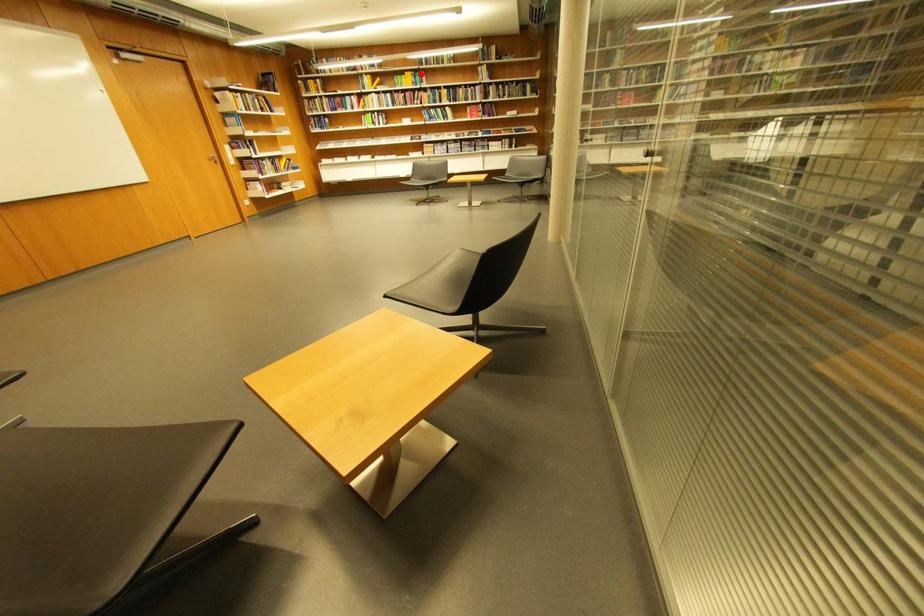
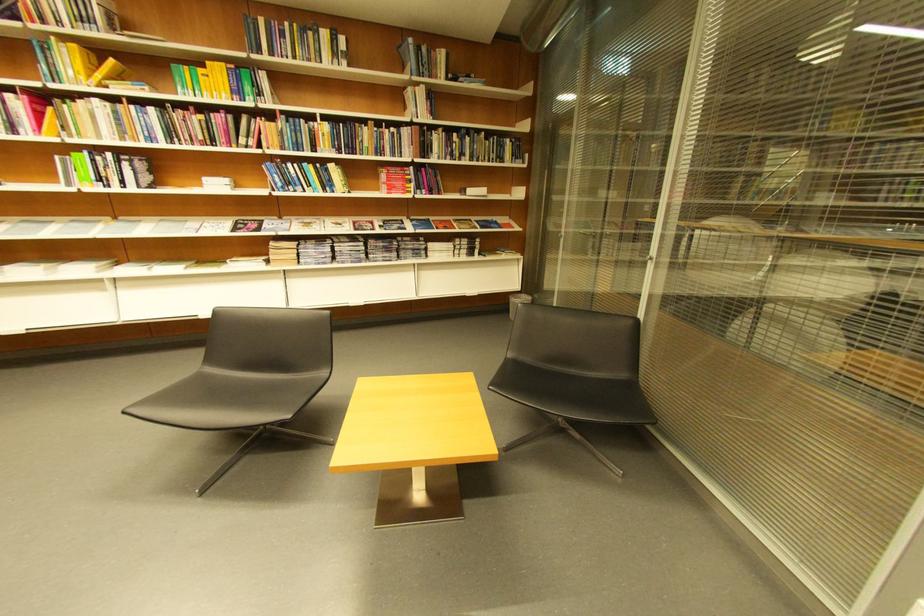
Question: A red point is marked in image1. In image2, is the corresponding 3D point closer to the camera or farther? Reply with the corresponding letter.

Choices:
 (A) The corresponding 3D point is closer.
 (B) The corresponding 3D point is farther.

Answer: (B)